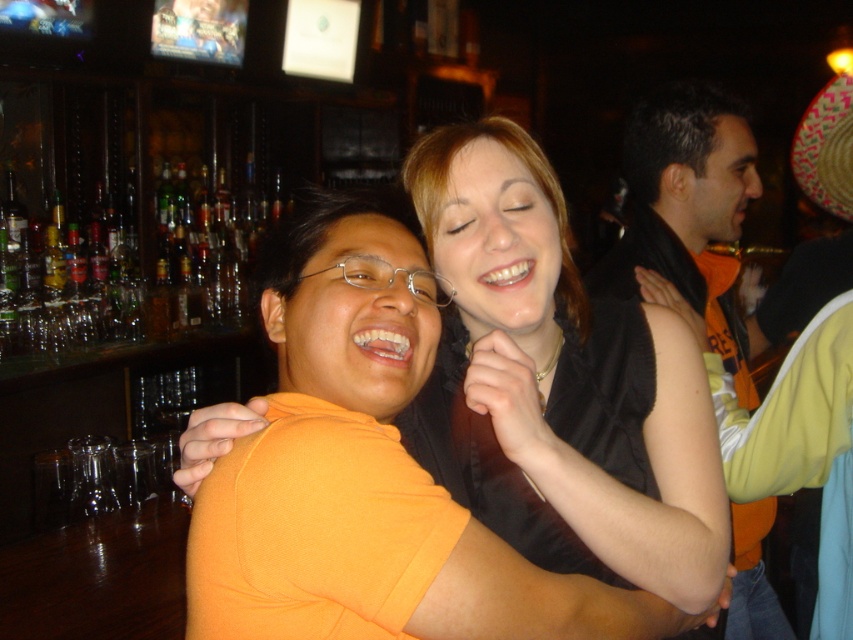
You are a photographer standing in the middle of the room. You want to take a photo of the orange matte shirt at center and the black sleeveless shirt at right. Since you want them both to be in focus, you need to know which one is taller. Which one is taller?

The orange matte shirt at center is taller than the black sleeveless shirt at right.

You are a fashion designer observing the scene. You need to create a new outfit that accommodates both the black sleeveless shirt at right and the patterned straw hat at upper right. Considering their sizes, which item should be placed on top to ensure proper visibility?

The black sleeveless shirt at right has a larger size compared to the patterned straw hat at upper right, so placing the black sleeveless shirt at right on top would ensure it is visible over the smaller hat.